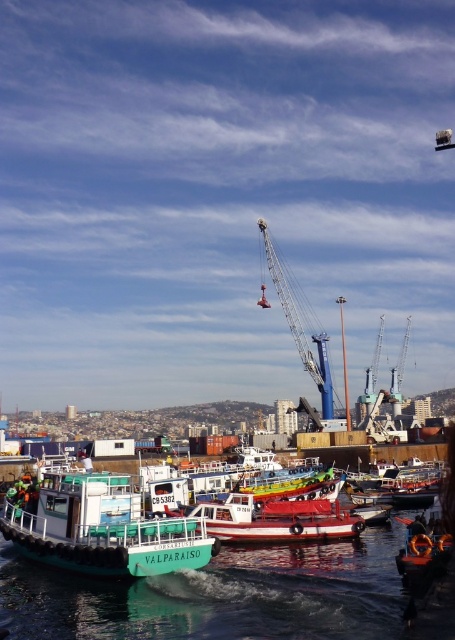
Question: Can you confirm if green matte boat at lower left is wider than blue metallic crane at center?

Choices:
 (A) no
 (B) yes

Answer: (B)

Question: Where is green rubber boat at lower left located in relation to green matte boat at lower left in the image?

Choices:
 (A) below
 (B) above

Answer: (A)

Question: Estimate the real-world distances between objects in this image. Which object is closer to the green matte boat at lower left?

Choices:
 (A) green rubber boat at lower left
 (B) blue metallic crane at center
 (C) white glossy boat at center

Answer: (A)

Question: Which of the following is the farthest from the observer?

Choices:
 (A) blue metallic crane at center
 (B) green rubber boat at lower left

Answer: (A)

Question: Among these objects, which one is nearest to the camera?

Choices:
 (A) white glossy boat at center
 (B) green matte boat at lower left
 (C) green rubber boat at lower left
 (D) blue metallic crane at center

Answer: (C)

Question: Does green rubber boat at lower left have a larger size compared to green matte boat at lower left?

Choices:
 (A) yes
 (B) no

Answer: (B)